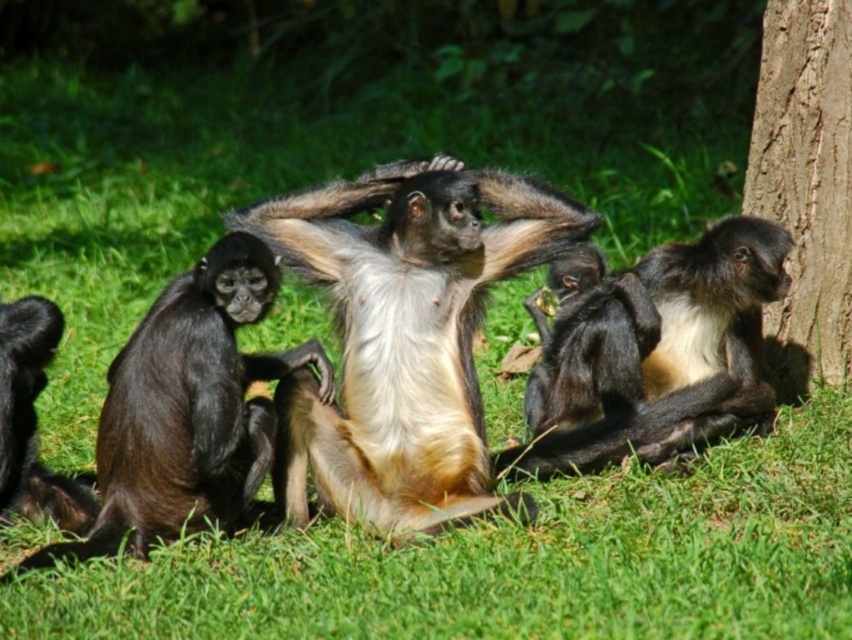
You are a photographer aiming to capture the spider monkeys in the scene. You notice two specific points marked as point 1 at coordinates point (304, 196) and point 2 at coordinates point (39, 509). Which point is positioned closer to your camera lens?

Point (304, 196) is closer to the viewer than point (39, 509), so the photographer should focus on point 1 for a closer shot.

You are standing at the origin point of the image coordinate system and want to locate the point at coordinates point (655, 355). According to the scene description, where is this point located?

The point (655, 355) is located on the black silky monkey at right.